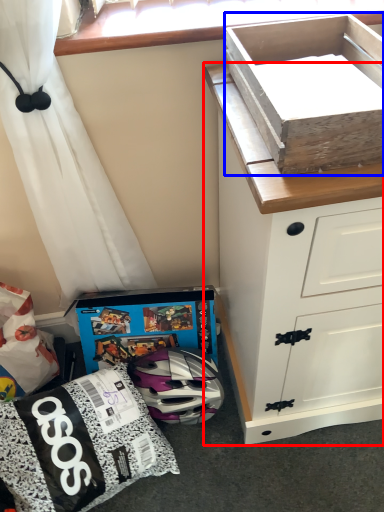
Question: Which of the following is the closest to the observer, chest of drawers (highlighted by a red box) or box (highlighted by a blue box)?

Choices:
 (A) chest of drawers
 (B) box

Answer: (B)